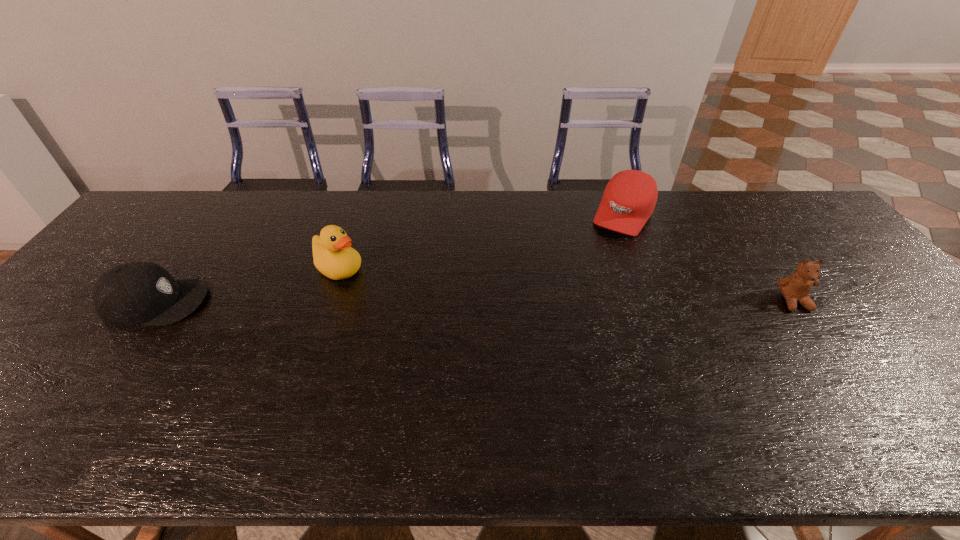
At what (x,y) coordinates should I click in order to perform the action: click on vacant area between the third object from left to right and the duck. Please return your answer as a coordinate pair (x, y). This screenshot has height=540, width=960. Looking at the image, I should click on (481, 242).

Choose which object is the second nearest neighbor to the teddy bear. Please provide its 2D coordinates. Your answer should be formatted as a tuple, i.e. [(x, y)], where the tuple contains the x and y coordinates of a point satisfying the conditions above.

[(332, 255)]

Identify which object is the second closest to the leftmost object. Please provide its 2D coordinates. Your answer should be formatted as a tuple, i.e. [(x, y)], where the tuple contains the x and y coordinates of a point satisfying the conditions above.

[(629, 199)]